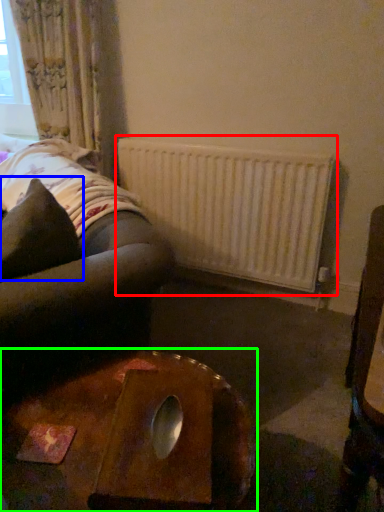
Question: Estimate the real-world distances between objects in this image. Which object is farther from radiator (highlighted by a red box), throw pillow (highlighted by a blue box) or table (highlighted by a green box)?

Choices:
 (A) throw pillow
 (B) table

Answer: (B)